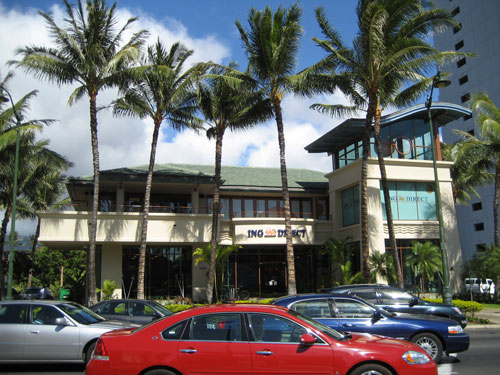
You are a GUI agent. You are given a task and a screenshot of the screen. Output one action in this format:
    pyautogui.click(x=<x>, y=<y>)
    Task: Click on the windows
    
    Given the screenshot: What is the action you would take?
    pyautogui.click(x=237, y=208), pyautogui.click(x=250, y=202)